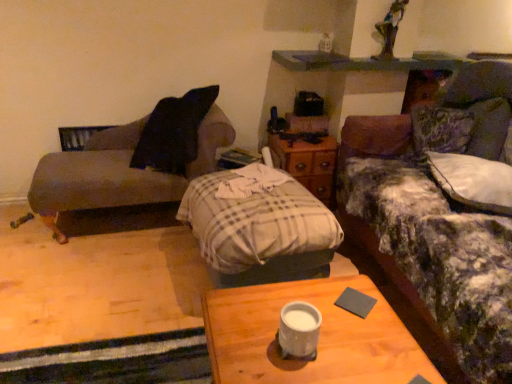
You are a GUI agent. You are given a task and a screenshot of the screen. Output one action in this format:
    pyautogui.click(x=<x>, y=<y>)
    Task: Click on the free space between white matte coffee cup at center and gray matte pad at center
    Image resolution: width=512 pixels, height=384 pixels.
    Given the screenshot: What is the action you would take?
    point(336,325)